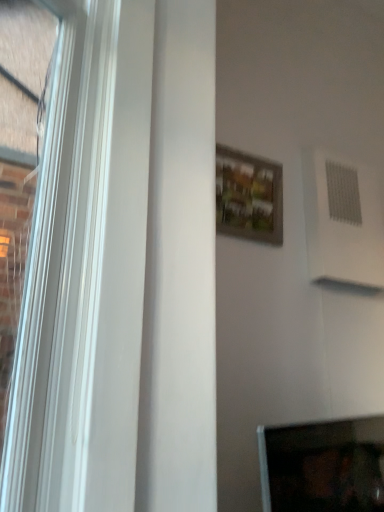
Question: From a real-world perspective, is matte black monitor at lower right located higher than wooden framed picture at center?

Choices:
 (A) yes
 (B) no

Answer: (B)

Question: Is the position of matte black monitor at lower right less distant than that of wooden framed picture at center?

Choices:
 (A) no
 (B) yes

Answer: (B)

Question: Is matte black monitor at lower right positioned with its back to wooden framed picture at center?

Choices:
 (A) yes
 (B) no

Answer: (B)

Question: Is matte black monitor at lower right behind wooden framed picture at center?

Choices:
 (A) no
 (B) yes

Answer: (A)

Question: Is wooden framed picture at center a part of matte black monitor at lower right?

Choices:
 (A) no
 (B) yes

Answer: (A)

Question: Considering the relative positions of matte black monitor at lower right and wooden framed picture at center in the image provided, is matte black monitor at lower right to the left of wooden framed picture at center from the viewer's perspective?

Choices:
 (A) no
 (B) yes

Answer: (A)

Question: Is wooden framed picture at center far from matte black monitor at lower right?

Choices:
 (A) no
 (B) yes

Answer: (B)

Question: Is matte black monitor at lower right located within wooden framed picture at center?

Choices:
 (A) no
 (B) yes

Answer: (A)

Question: Is wooden framed picture at center bigger than matte black monitor at lower right?

Choices:
 (A) yes
 (B) no

Answer: (B)

Question: Considering the relative positions of wooden framed picture at center and matte black monitor at lower right in the image provided, is wooden framed picture at center to the left of matte black monitor at lower right from the viewer's perspective?

Choices:
 (A) yes
 (B) no

Answer: (A)

Question: Is wooden framed picture at center touching matte black monitor at lower right?

Choices:
 (A) no
 (B) yes

Answer: (A)

Question: Considering the relative positions of wooden framed picture at center and matte black monitor at lower right in the image provided, is wooden framed picture at center to the right of matte black monitor at lower right from the viewer's perspective?

Choices:
 (A) yes
 (B) no

Answer: (B)

Question: From a real-world perspective, is matte black monitor at lower right physically located above or below wooden framed picture at center?

Choices:
 (A) above
 (B) below

Answer: (B)